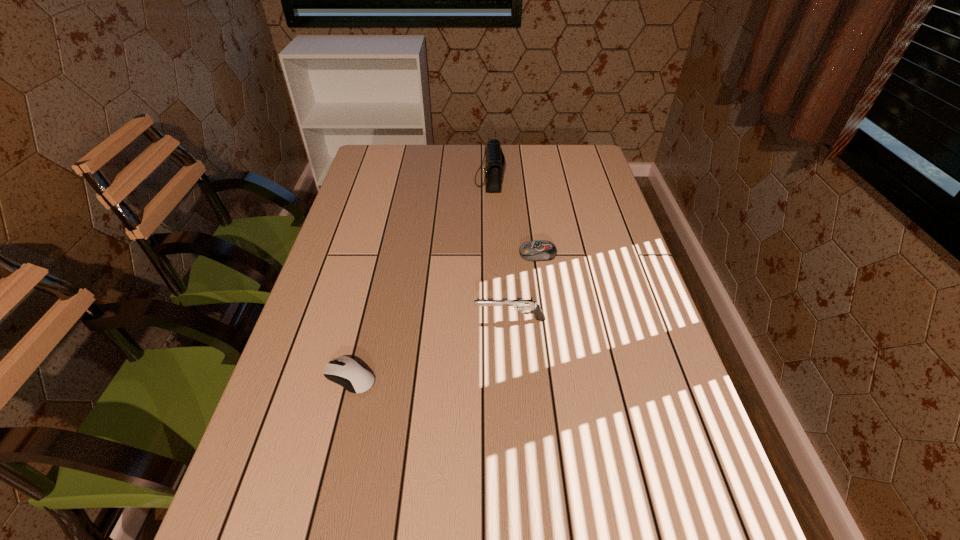
Where is `free space at the far edge of the desktop`? This screenshot has height=540, width=960. free space at the far edge of the desktop is located at coordinates (468, 152).

In order to click on vacant space at the left edge of the desktop in this screenshot , I will do `click(300, 377)`.

Identify the location of vacant space at the right edge of the desktop. This screenshot has height=540, width=960. (601, 277).

In the image, there is a desktop. What are the coordinates of `blank space at the far right corner` in the screenshot? It's located at (592, 165).

Find the location of a particular element. The image size is (960, 540). free space between the tallest object and the second farthest object is located at coordinates (514, 217).

Find the location of a particular element. This screenshot has height=540, width=960. free space that is in between the right computer mouse and the nearest object is located at coordinates (444, 316).

Identify the location of vacant space that is in between the nearer computer mouse and the third farthest object. (430, 348).

In order to click on unoccupied area between the right computer mouse and the clutch bag in this screenshot , I will do `click(514, 217)`.

You are a GUI agent. You are given a task and a screenshot of the screen. Output one action in this format:
    pyautogui.click(x=<x>, y=<y>)
    Task: Click on the free space between the leftmost object and the clutch bag
    This screenshot has width=960, height=540.
    Given the screenshot: What is the action you would take?
    pyautogui.click(x=420, y=279)

Locate an element on the screen. free space that is in between the third nearest object and the third farthest object is located at coordinates (524, 287).